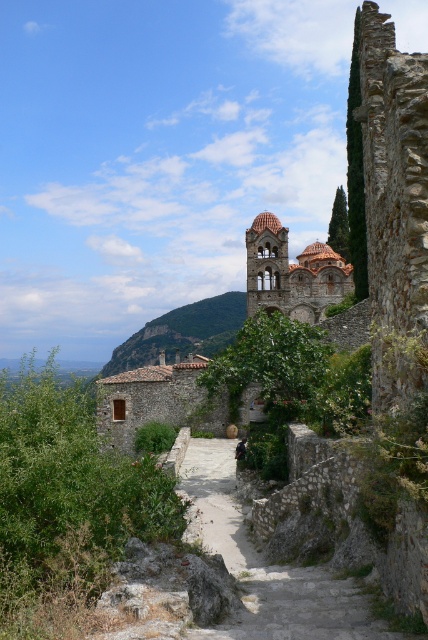
Question: Estimate the real-world distances between objects in this image. Which object is farther from the brown stone tower at center?

Choices:
 (A) green stone wall at center
 (B) stone steps at center

Answer: (A)

Question: Which point is farther to the camera?

Choices:
 (A) 314,316
 (B) 145,348
 (C) 219,481

Answer: (B)

Question: Is stone steps at center above green stone wall at center?

Choices:
 (A) no
 (B) yes

Answer: (A)

Question: Is stone steps at center positioned in front of green stone wall at center?

Choices:
 (A) yes
 (B) no

Answer: (A)

Question: Which point is closer to the camera?

Choices:
 (A) (321, 289)
 (B) (148, 349)

Answer: (A)

Question: Does stone steps at center lie behind brown stone tower at center?

Choices:
 (A) no
 (B) yes

Answer: (A)